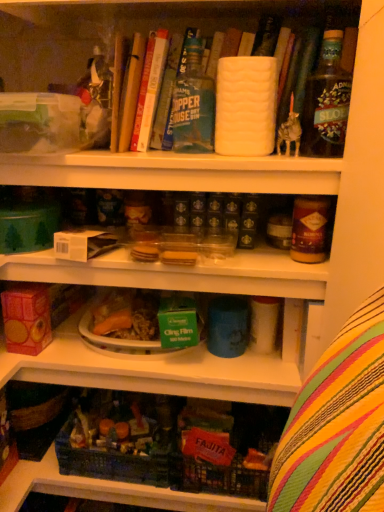
Question: From the image's perspective, is translucent plastic container at center, marked as the first shelf in a bottom-to-top arrangement, above or below brown glass jar at upper right?

Choices:
 (A) below
 (B) above

Answer: (A)

Question: Is translucent plastic container at center, marked as the first shelf in a bottom-to-top arrangement, to the left or to the right of brown glass jar at upper right in the image?

Choices:
 (A) left
 (B) right

Answer: (A)

Question: Estimate the real-world distances between objects in this image. Which object is farther from the green glass bottle at upper right, which is the 1th bottle from right to left?

Choices:
 (A) hardcover book at upper center, the 1th book viewed from the right
 (B) hardcover book at upper center, which is the second book from left to right
 (C) hardcover book at upper center, arranged as the first book when viewed from the left
 (D) clear plastic container at center, which appears as the second shelf when ordered from the bottom
 (E) brown glass jar at upper right

Answer: (C)

Question: Which object is positioned farthest from the hardcover book at upper center, arranged as the first book when viewed from the left?

Choices:
 (A) hardcover book at upper center, the 1th book viewed from the right
 (B) brown glass jar at upper right
 (C) green matte bottle at upper center, acting as the 2th bottle starting from the right
 (D) translucent plastic container at center, marked as the first shelf in a bottom-to-top arrangement
 (E) matte brown jar at upper right

Answer: (E)